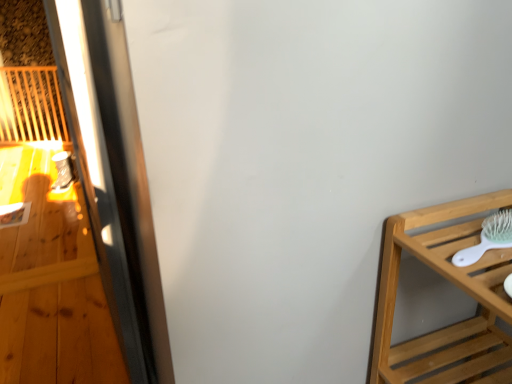
Describe the element at coordinates (458, 287) in the screenshot. This screenshot has height=384, width=512. I see `light brown wooden shelf at right` at that location.

Locate an element on the screen. This screenshot has width=512, height=384. white plastic brush at right is located at coordinates (488, 238).

This screenshot has width=512, height=384. In order to click on metallic screen door at left in this screenshot , I will do `click(113, 175)`.

Which of these two, metallic screen door at left or white plastic brush at right, is bigger?

metallic screen door at left is bigger.

Which object is wider, metallic screen door at left or white plastic brush at right?

white plastic brush at right is wider.

Considering the points (82, 54) and (510, 226), which point is in front, point (82, 54) or point (510, 226)?

Point (510, 226)

I want to click on screen door to the left of white plastic brush at right, so click(113, 175).

Does white plastic brush at right have a lesser width compared to light brown wooden shelf at right?

Correct, the width of white plastic brush at right is less than that of light brown wooden shelf at right.

Consider the image. Does white plastic brush at right touch light brown wooden shelf at right?

No, white plastic brush at right is not with light brown wooden shelf at right.

From the image's perspective, between white plastic brush at right and light brown wooden shelf at right, which one is located above?

white plastic brush at right.

From a real-world perspective, which is physically below, white plastic brush at right or metallic screen door at left?

From a 3D spatial view, metallic screen door at left is below.

Is white plastic brush at right positioned before metallic screen door at left?

Yes, white plastic brush at right is closer to the viewer.

From the image's perspective, is white plastic brush at right above or below metallic screen door at left?

Based on their image positions, white plastic brush at right is located beneath metallic screen door at left.

Is point (483, 227) more distant than point (138, 291)?

No, (483, 227) is in front of (138, 291).

Is point (101, 95) behind point (398, 346)?

No.

From the image's perspective, is metallic screen door at left over light brown wooden shelf at right?

Yes, from the image's perspective, metallic screen door at left is on top of light brown wooden shelf at right.

Is metallic screen door at left far from light brown wooden shelf at right?

They are positioned close to each other.

From a real-world perspective, is light brown wooden shelf at right positioned above or below white plastic brush at right?

In terms of real-world spatial position, light brown wooden shelf at right is below white plastic brush at right.

Is light brown wooden shelf at right facing towards white plastic brush at right?

No, light brown wooden shelf at right is not facing towards white plastic brush at right.

Can we say light brown wooden shelf at right lies outside white plastic brush at right?

light brown wooden shelf at right is positioned outside white plastic brush at right.

From the image's perspective, is light brown wooden shelf at right positioned above or below white plastic brush at right?

light brown wooden shelf at right is below white plastic brush at right.

The height and width of the screenshot is (384, 512). I want to click on furniture lying in front of the metallic screen door at left, so click(x=458, y=287).

From the image's perspective, is light brown wooden shelf at right above or below metallic screen door at left?

Based on their image positions, light brown wooden shelf at right is located beneath metallic screen door at left.

Which object is thinner, light brown wooden shelf at right or metallic screen door at left?

Thinner between the two is metallic screen door at left.

Is light brown wooden shelf at right bigger or smaller than metallic screen door at left?

Considering their sizes, light brown wooden shelf at right takes up less space than metallic screen door at left.

This screenshot has height=384, width=512. Identify the location of screen door below the white plastic brush at right (from a real-world perspective). (113, 175).

You are a GUI agent. You are given a task and a screenshot of the screen. Output one action in this format:
    pyautogui.click(x=<x>, y=<y>)
    Task: Click on the brush behind the light brown wooden shelf at right
    The image size is (512, 384).
    Given the screenshot: What is the action you would take?
    pyautogui.click(x=488, y=238)

Considering their positions, is light brown wooden shelf at right positioned closer to white plastic brush at right than metallic screen door at left?

light brown wooden shelf at right.

Which object lies nearer to the anchor point white plastic brush at right, metallic screen door at left or light brown wooden shelf at right?

light brown wooden shelf at right is positioned closer to the anchor white plastic brush at right.

Based on their spatial positions, is white plastic brush at right or metallic screen door at left further from light brown wooden shelf at right?

Based on the image, metallic screen door at left appears to be further to light brown wooden shelf at right.

From the image, which object appears to be farther from metallic screen door at left, white plastic brush at right or light brown wooden shelf at right?

white plastic brush at right lies further to metallic screen door at left than the other object.

Which object lies further to the anchor point light brown wooden shelf at right, metallic screen door at left or white plastic brush at right?

Among the two, metallic screen door at left is located further to light brown wooden shelf at right.

From the image, which object appears to be farther from metallic screen door at left, light brown wooden shelf at right or white plastic brush at right?

white plastic brush at right lies further to metallic screen door at left than the other object.

The image size is (512, 384). I want to click on brush located between metallic screen door at left and light brown wooden shelf at right in the left-right direction, so click(488, 238).